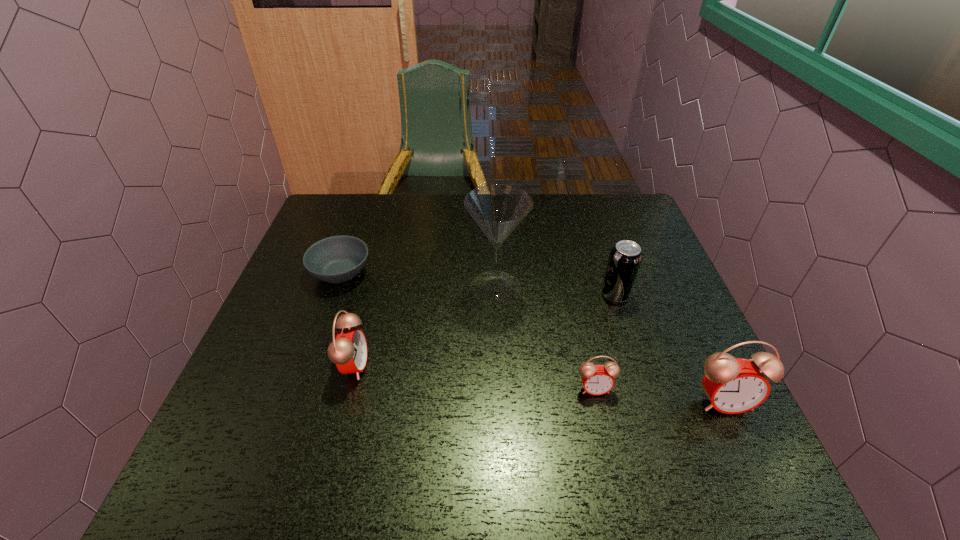
This screenshot has height=540, width=960. Identify the location of the leftmost alarm clock. (348, 350).

The height and width of the screenshot is (540, 960). I want to click on the fourth object from left to right, so click(597, 379).

Find the location of a particular element. the second alarm clock from left to right is located at coordinates (597, 379).

Find the location of `the rightmost alarm clock`. the rightmost alarm clock is located at coordinates pos(733,385).

Image resolution: width=960 pixels, height=540 pixels. I want to click on flute glass, so click(x=498, y=209).

Find the location of a particular element. The height and width of the screenshot is (540, 960). the third object from left to right is located at coordinates (498, 209).

This screenshot has width=960, height=540. In order to click on soda can in this screenshot , I will do `click(625, 258)`.

Where is `the shortest object`? the shortest object is located at coordinates (337, 259).

At what (x,y) coordinates should I click in order to perform the action: click on vacant space located on the clock face of the leftmost alarm clock. Please return your answer as a coordinate pair (x, y). This screenshot has width=960, height=540. Looking at the image, I should click on (485, 365).

Identify the location of vacant space located 0.080m on the clock face of the second alarm clock from left to right. This screenshot has height=540, width=960. (605, 432).